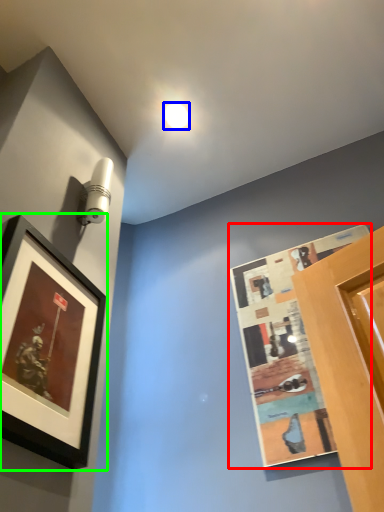
Question: Estimate the real-world distances between objects in this image. Which object is farther from picture frame (highlighted by a red box), droplight (highlighted by a blue box) or picture frame (highlighted by a green box)?

Choices:
 (A) droplight
 (B) picture frame

Answer: (A)